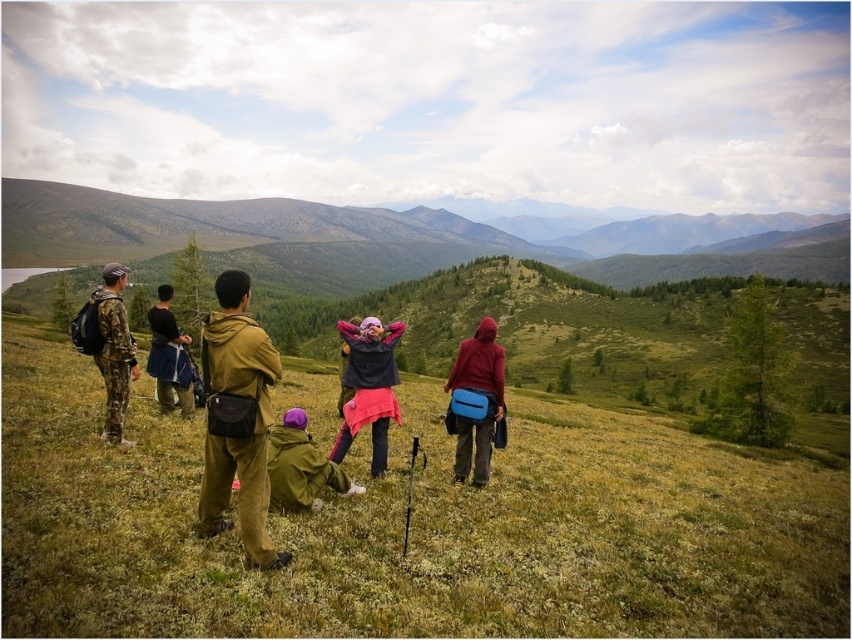
The image size is (852, 640). Describe the element at coordinates (412, 528) in the screenshot. I see `green grassy at center` at that location.

Who is more forward, [712,516] or [390,378]?

Point [390,378] is in front.

At what (x,y) coordinates should I click in order to perform the action: click on green grassy at center. Please return your answer as a coordinate pair (x, y). The width and height of the screenshot is (852, 640). Looking at the image, I should click on (412, 528).

Is brown corduroy jacket at center further to the viewer compared to pink fabric at center?

That is False.

Between brown corduroy jacket at center and pink fabric at center, which one appears on the left side from the viewer's perspective?

brown corduroy jacket at center is more to the left.

The height and width of the screenshot is (640, 852). Find the location of `brown corduroy jacket at center`. brown corduroy jacket at center is located at coordinates (242, 429).

In order to click on brown corduroy jacket at center in this screenshot , I will do `click(242, 429)`.

Does brown corduroy jacket at center appear on the right side of dark blue fabric jacket at center?

Indeed, brown corduroy jacket at center is positioned on the right side of dark blue fabric jacket at center.

Which is behind, point (229, 440) or point (173, 404)?

The point (173, 404) is more distant.

Where is `brown corduroy jacket at center`? Image resolution: width=852 pixels, height=640 pixels. brown corduroy jacket at center is located at coordinates (242, 429).